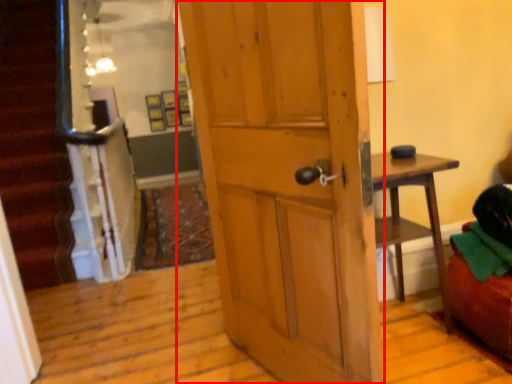
Question: From the image's perspective, considering the relative positions of door (annotated by the red box) and bean bag chair in the image provided, where is door (annotated by the red box) located with respect to the staircase?

Choices:
 (A) below
 (B) above

Answer: (B)